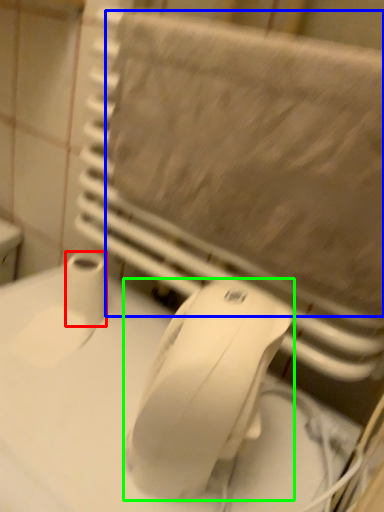
Question: Which is farther away from toilet paper (highlighted by a red box)? bath towel (highlighted by a blue box) or mouse (highlighted by a green box)?

Choices:
 (A) bath towel
 (B) mouse

Answer: (B)